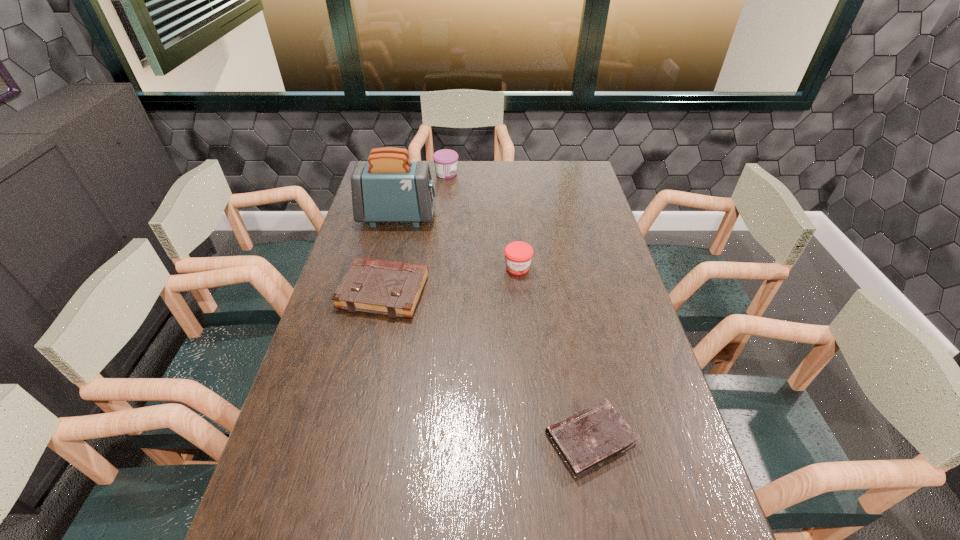
Where is `toaster`? toaster is located at coordinates (388, 187).

Where is `the tallest object`? the tallest object is located at coordinates (388, 187).

Image resolution: width=960 pixels, height=540 pixels. Find the location of `the farthest object`. the farthest object is located at coordinates (445, 160).

Find the location of a particular element. This screenshot has width=960, height=540. the left jam is located at coordinates (445, 160).

The height and width of the screenshot is (540, 960). Identify the location of the third shortest object. (518, 255).

At what (x,y) coordinates should I click in order to perform the action: click on the right jam. Please return your answer as a coordinate pair (x, y). This screenshot has height=540, width=960. Looking at the image, I should click on 518,255.

Where is `the fourth tallest object`? This screenshot has height=540, width=960. the fourth tallest object is located at coordinates (391, 288).

At what (x,y) coordinates should I click in order to perform the action: click on the shortest object. Please return your answer as a coordinate pair (x, y). The image size is (960, 540). Looking at the image, I should click on (587, 439).

At what (x,y) coordinates should I click in order to perform the action: click on diary. Please return your answer as a coordinate pair (x, y). The image size is (960, 540). Looking at the image, I should click on (587, 439).

The image size is (960, 540). I want to click on free space located 0.380m on the front-facing side of the fourth nearest object, so click(x=536, y=217).